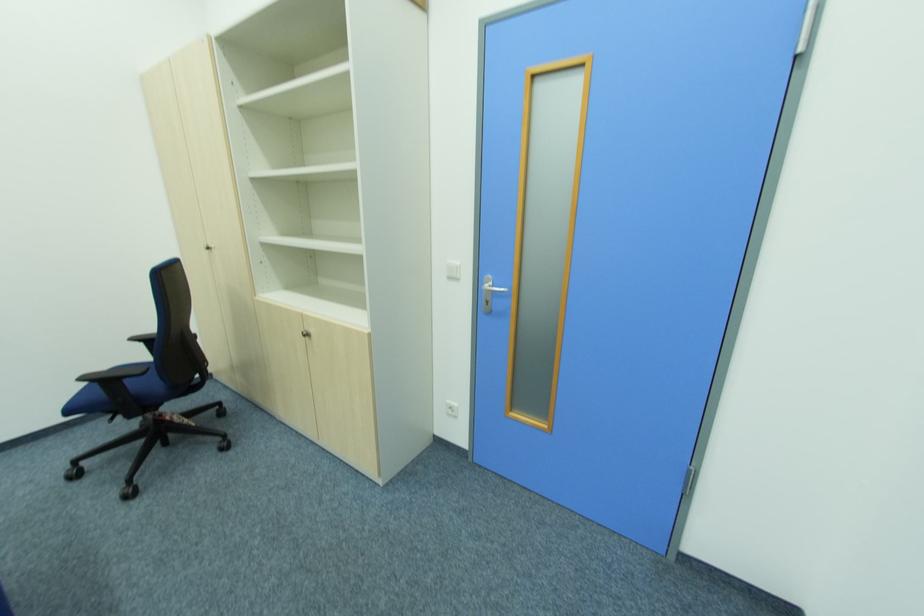
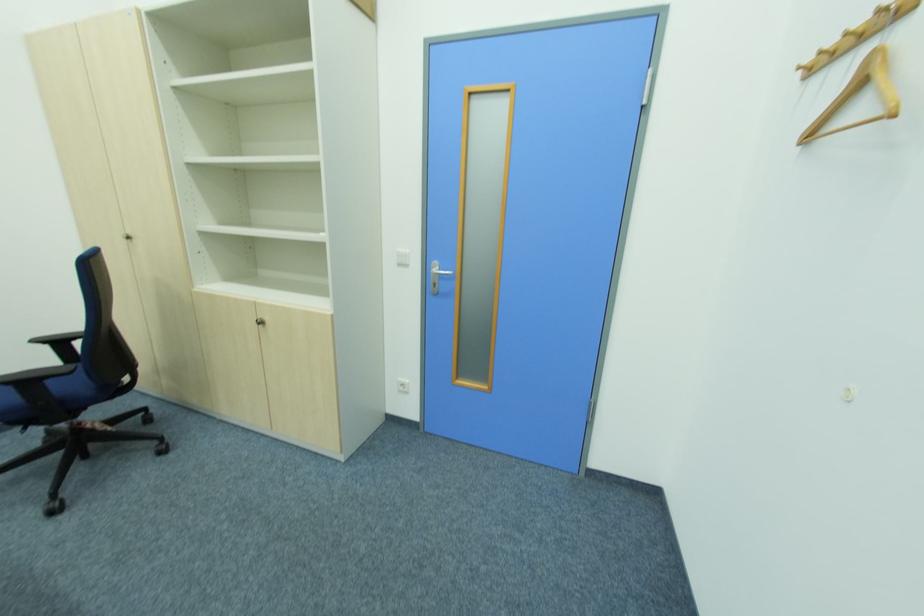
Find the pixel in the second image that matches point 454,410 in the first image.

(407, 387)